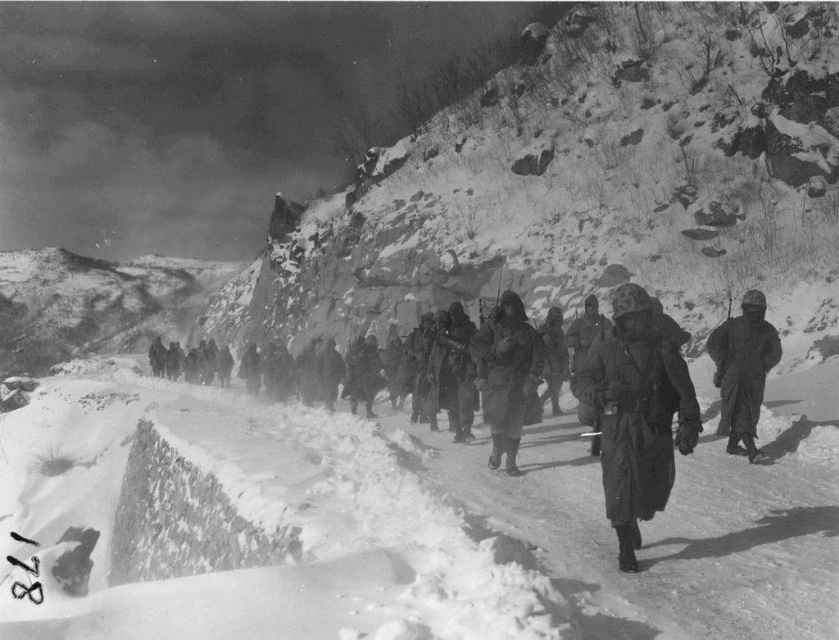
Between point (655, 532) and point (736, 321), which one is positioned in front?

Point (655, 532) is more forward.

Find the location of `white powdery snow at center`. white powdery snow at center is located at coordinates (370, 531).

Is white powdery snow at center behind rocky snow at center?

No.

Between point (305, 454) and point (259, 272), which one is positioned behind?

Positioned behind is point (259, 272).

Where is `white powdery snow at center`? This screenshot has height=640, width=839. white powdery snow at center is located at coordinates (370, 531).

Image resolution: width=839 pixels, height=640 pixels. I want to click on white powdery snow at center, so click(370, 531).

Between point (327, 452) and point (610, 392), which one is positioned in front?

Point (610, 392) is in front.

Does white powdery snow at center have a greater height compared to camouflage fabric uniform at center?

Yes.

What do you see at coordinates (370, 531) in the screenshot? I see `white powdery snow at center` at bounding box center [370, 531].

The height and width of the screenshot is (640, 839). I want to click on white powdery snow at center, so click(370, 531).